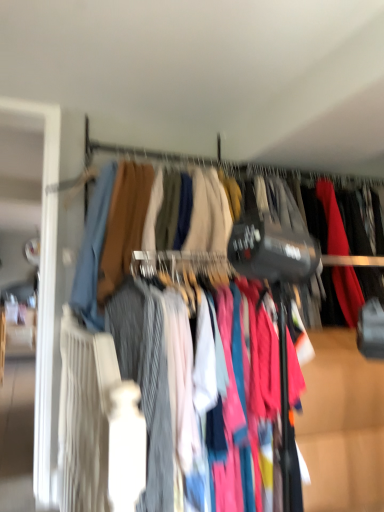
The image size is (384, 512). I want to click on matte fabric dress at center, so click(x=145, y=379).

Find the location of a particular element. This screenshot has height=512, width=384. textured fabric clothes at center is located at coordinates (93, 251).

This screenshot has height=512, width=384. What do you see at coordinates (243, 167) in the screenshot? I see `matte fabric clothesline at upper center` at bounding box center [243, 167].

Identify the location of striped cotton pants at center. (342, 426).

Is matte fabric clothesline at upper center inside or outside of striped cotton pants at center?

matte fabric clothesline at upper center lies outside striped cotton pants at center.

Based on the photo, is matte fabric clothesline at upper center far away from striped cotton pants at center?

Yes, matte fabric clothesline at upper center is far from striped cotton pants at center.

From the image's perspective, would you say matte fabric clothesline at upper center is positioned over striped cotton pants at center?

Correct, matte fabric clothesline at upper center appears higher than striped cotton pants at center in the image.

Considering the sizes of objects matte fabric clothesline at upper center and striped cotton pants at center in the image provided, who is thinner, matte fabric clothesline at upper center or striped cotton pants at center?

Thinner between the two is matte fabric clothesline at upper center.

Which is more to the left, textured fabric clothes at center or matte fabric clothesline at upper center?

Positioned to the left is textured fabric clothes at center.

In terms of width, does textured fabric clothes at center look wider or thinner when compared to matte fabric clothesline at upper center?

Considering their sizes, textured fabric clothes at center looks broader than matte fabric clothesline at upper center.

From a real-world perspective, is textured fabric clothes at center physically located above or below matte fabric clothesline at upper center?

Clearly, from a real-world perspective, textured fabric clothes at center is below matte fabric clothesline at upper center.

Consider the image. What's the angular difference between matte fabric dress at center and striped cotton pants at center's facing directions?

The facing directions of matte fabric dress at center and striped cotton pants at center are 3.63e-05 degrees apart.

Could you tell me if matte fabric dress at center is facing striped cotton pants at center?

Yes.

From the image's perspective, who appears lower, matte fabric dress at center or striped cotton pants at center?

From the image's view, striped cotton pants at center is below.

Considering their positions, is matte fabric dress at center located in front of or behind striped cotton pants at center?

matte fabric dress at center is positioned farther from the viewer than striped cotton pants at center.

How much distance is there between matte fabric dress at center and textured fabric clothes at center?

A distance of 14.57 inches exists between matte fabric dress at center and textured fabric clothes at center.

Which of these two, matte fabric dress at center or textured fabric clothes at center, is wider?

Wider between the two is matte fabric dress at center.

Does matte fabric dress at center touch textured fabric clothes at center?

No, matte fabric dress at center is not beside textured fabric clothes at center.

Does matte fabric dress at center turn towards textured fabric clothes at center?

No, matte fabric dress at center is not oriented towards textured fabric clothes at center.

Which is further, (x=185, y=219) or (x=307, y=443)?

The point (x=185, y=219) is farther from the camera.

Considering the relative sizes of textured fabric clothes at center and striped cotton pants at center in the image provided, is textured fabric clothes at center bigger than striped cotton pants at center?

No, textured fabric clothes at center is not bigger than striped cotton pants at center.

From a real-world perspective, who is located higher, textured fabric clothes at center or striped cotton pants at center?

textured fabric clothes at center, from a real-world perspective.

From the image's perspective, is textured fabric clothes at center beneath striped cotton pants at center?

Incorrect, from the image's perspective, textured fabric clothes at center is higher than striped cotton pants at center.

Is matte fabric dress at center bigger or smaller than matte fabric clothesline at upper center?

Clearly, matte fabric dress at center is larger in size than matte fabric clothesline at upper center.

From the image's perspective, who appears lower, matte fabric dress at center or matte fabric clothesline at upper center?

matte fabric dress at center.

Is matte fabric dress at center facing away from matte fabric clothesline at upper center?

No, matte fabric clothesline at upper center is not at the back of matte fabric dress at center.

Which is behind, matte fabric clothesline at upper center or matte fabric dress at center?

matte fabric clothesline at upper center is more distant.

Which of these two, matte fabric clothesline at upper center or matte fabric dress at center, stands taller?

matte fabric dress at center.

Is matte fabric clothesline at upper center far from matte fabric dress at center?

Yes, matte fabric clothesline at upper center and matte fabric dress at center are quite far apart.

Image resolution: width=384 pixels, height=512 pixels. Find the location of `trousers that appears on the left of matte fabric clothesline at upper center`. trousers that appears on the left of matte fabric clothesline at upper center is located at coordinates (342, 426).

Locate an element on the screen. The image size is (384, 512). closet below the matte fabric clothesline at upper center (from the image's perspective) is located at coordinates (93, 251).

Based on their spatial positions, is striped cotton pants at center or textured fabric clothes at center further from matte fabric clothesline at upper center?

Among the two, striped cotton pants at center is located further to matte fabric clothesline at upper center.

Looking at the image, which one is located closer to matte fabric dress at center, matte fabric clothesline at upper center or textured fabric clothes at center?

textured fabric clothes at center is positioned closer to the anchor matte fabric dress at center.

From the picture: Estimate the real-world distances between objects in this image. Which object is further from textured fabric clothes at center, striped cotton pants at center or matte fabric clothesline at upper center?

striped cotton pants at center is further to textured fabric clothes at center.

From the image, which object appears to be farther from matte fabric clothesline at upper center, textured fabric clothes at center or matte fabric dress at center?

matte fabric dress at center is further to matte fabric clothesline at upper center.

Which object lies further to the anchor point matte fabric clothesline at upper center, matte fabric dress at center or textured fabric clothes at center?

matte fabric dress at center lies further to matte fabric clothesline at upper center than the other object.

Based on their spatial positions, is textured fabric clothes at center or matte fabric clothesline at upper center further from matte fabric dress at center?

matte fabric clothesline at upper center lies further to matte fabric dress at center than the other object.

Looking at the image, which one is located closer to striped cotton pants at center, matte fabric dress at center or matte fabric clothesline at upper center?

matte fabric dress at center.

Which object lies further to the anchor point matte fabric clothesline at upper center, striped cotton pants at center or matte fabric dress at center?

Among the two, striped cotton pants at center is located further to matte fabric clothesline at upper center.

Locate an element on the screen. closet between matte fabric clothesline at upper center and striped cotton pants at center in the vertical direction is located at coordinates (93, 251).

Locate an element on the screen. This screenshot has height=512, width=384. clothing between matte fabric clothesline at upper center and striped cotton pants at center in the vertical direction is located at coordinates (145, 379).

Where is `closet between matte fabric clothesline at upper center and matte fabric dress at center in the up-down direction`? Image resolution: width=384 pixels, height=512 pixels. closet between matte fabric clothesline at upper center and matte fabric dress at center in the up-down direction is located at coordinates (93, 251).

Where is `clothing between textured fabric clothes at center and striped cotton pants at center in the vertical direction`? clothing between textured fabric clothes at center and striped cotton pants at center in the vertical direction is located at coordinates [145, 379].